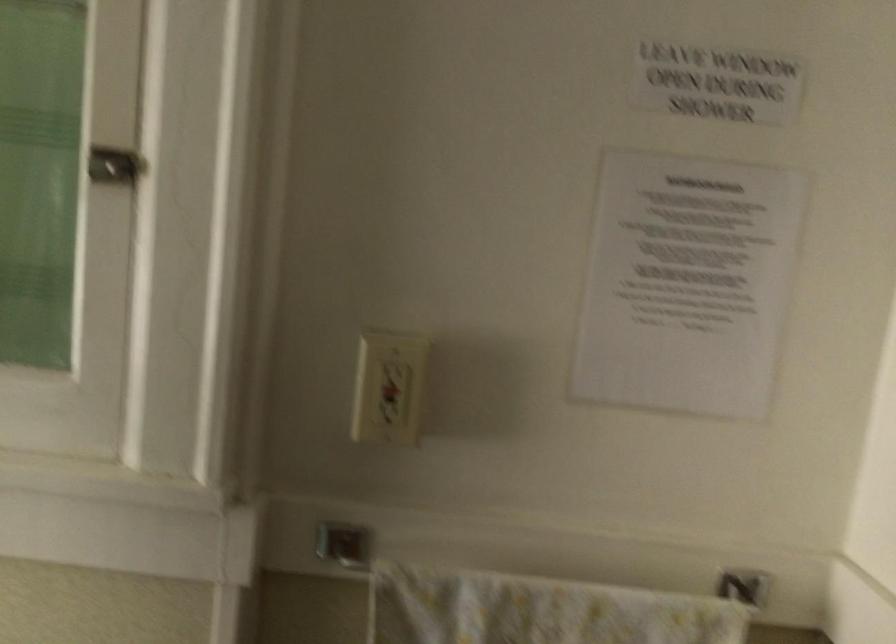
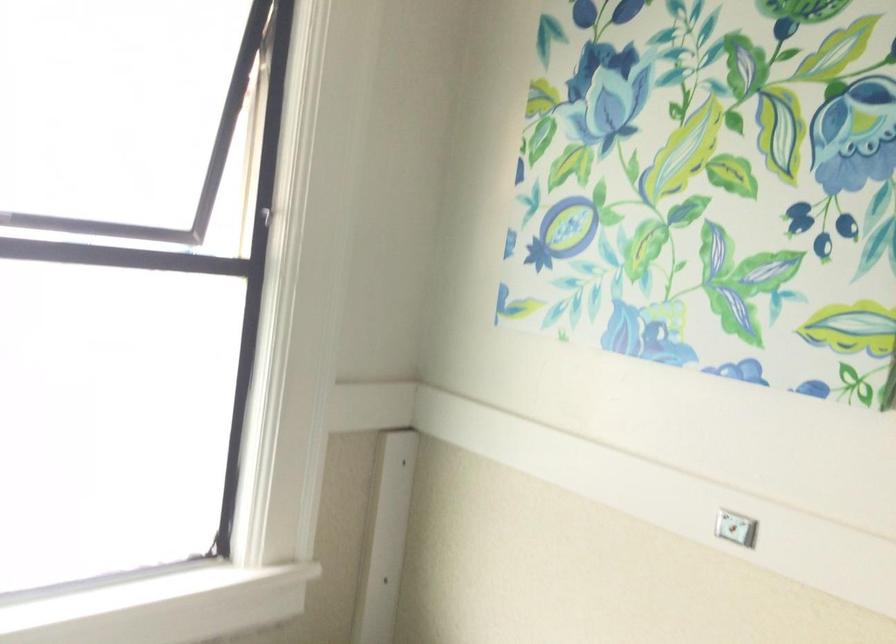
Question: How did the camera likely rotate?

Choices:
 (A) Left
 (B) Right
 (C) Up
 (D) Down

Answer: (A)